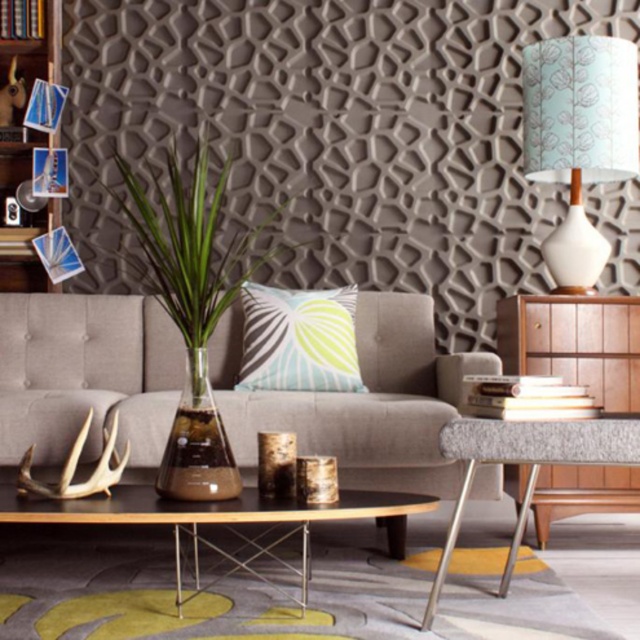
Question: Considering the relative positions of suede couch at center and textured blue-green pillow at center in the image provided, where is suede couch at center located with respect to textured blue-green pillow at center?

Choices:
 (A) left
 (B) right

Answer: (A)

Question: Which point appears closest to the camera in this image?

Choices:
 (A) pyautogui.click(x=97, y=465)
 (B) pyautogui.click(x=22, y=237)

Answer: (A)

Question: Which object is the farthest from the white fabric lampshade at upper right?

Choices:
 (A) wooden bookshelf at left
 (B) clear glass vase at center

Answer: (A)

Question: Is wooden table at center to the right of white antler at lower left from the viewer's perspective?

Choices:
 (A) yes
 (B) no

Answer: (A)

Question: Considering the relative positions of white fabric lampshade at upper right and metallic silver table at lower right in the image provided, where is white fabric lampshade at upper right located with respect to metallic silver table at lower right?

Choices:
 (A) left
 (B) right

Answer: (B)

Question: Which of the following is the closest to the observer?

Choices:
 (A) (186, 512)
 (B) (195, 179)
 (C) (461, 502)

Answer: (C)